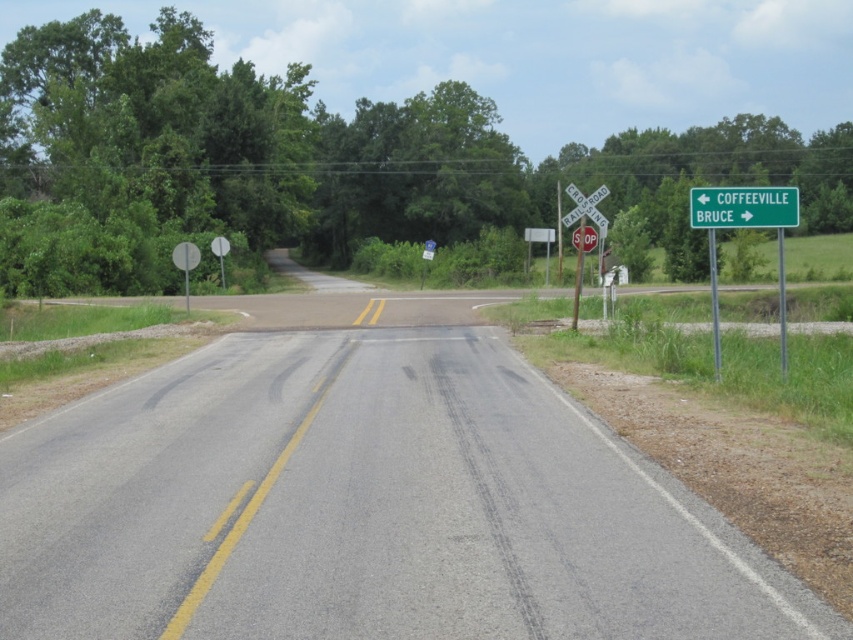
Does asphalt road at center have a lesser height compared to green metallic sign at upper right?

Yes.

Is asphalt road at center above green metallic sign at upper right?

No.

What do you see at coordinates (364, 502) in the screenshot? I see `asphalt road at center` at bounding box center [364, 502].

In order to click on asphalt road at center in this screenshot , I will do `click(364, 502)`.